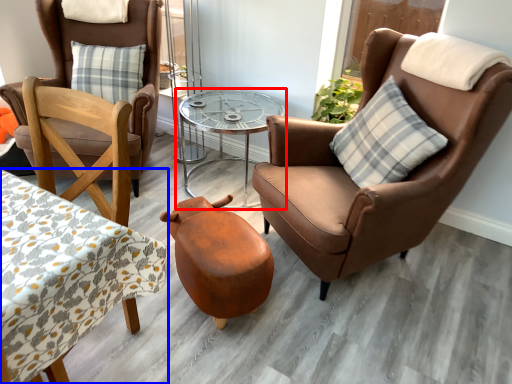
Question: Which object is further to the camera taking this photo, table (highlighted by a red box) or coffee table (highlighted by a blue box)?

Choices:
 (A) table
 (B) coffee table

Answer: (A)